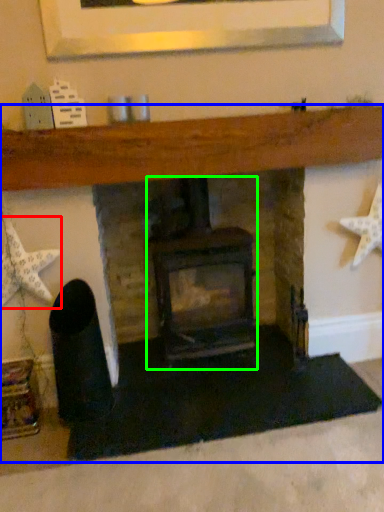
Question: Which is farther away from starfish (highlighted by a red box)? fireplace (highlighted by a blue box) or wood burning stove (highlighted by a green box)?

Choices:
 (A) fireplace
 (B) wood burning stove

Answer: (B)